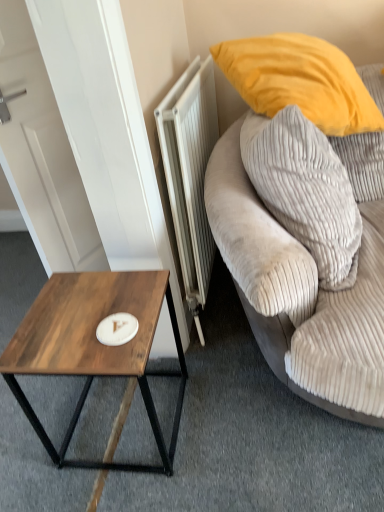
You are a GUI agent. You are given a task and a screenshot of the screen. Output one action in this format:
    pyautogui.click(x=<x>, y=<y>)
    Task: Click on the free location to the left of white matte plate at center
    
    Given the screenshot: What is the action you would take?
    57,335